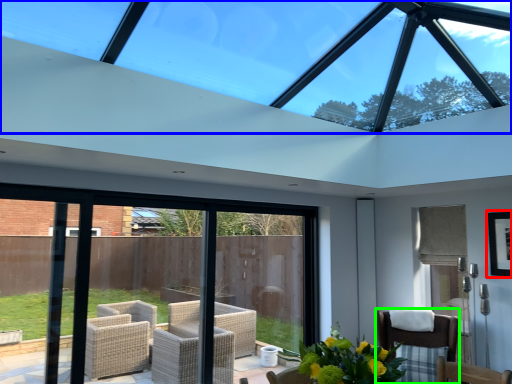
Question: Which object is the farthest from picture frame (highlighted by a red box)? Choose among these: window (highlighted by a blue box) or chair (highlighted by a green box).

Choices:
 (A) window
 (B) chair

Answer: (A)